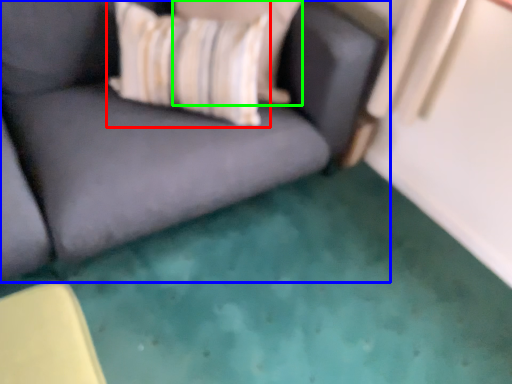
Question: Based on their relative distances, which object is farther from throw pillow (highlighted by a red box)? Choose from studio couch (highlighted by a blue box) and pillow (highlighted by a green box).

Choices:
 (A) studio couch
 (B) pillow

Answer: (A)